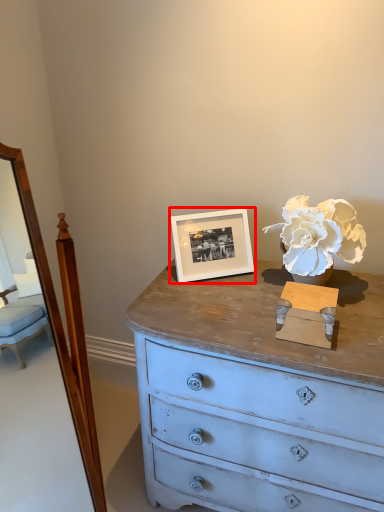
Question: From the image's perspective, where is picture frame (annotated by the red box) located relative to flower?

Choices:
 (A) below
 (B) above

Answer: (A)